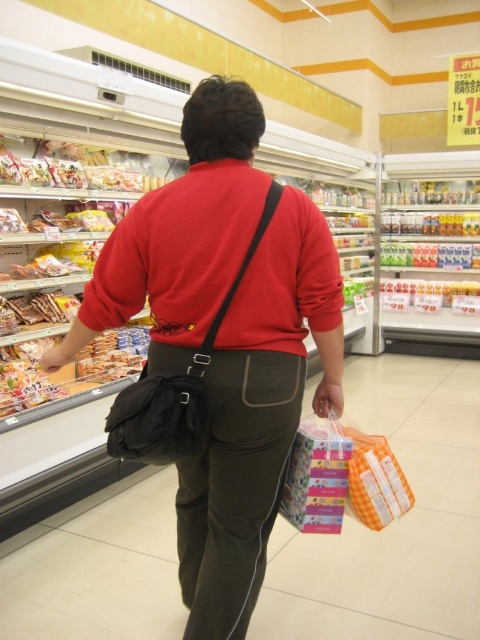
You are a store employee trying to determine which bag is taller between the matte black bag at center and the black fabric bag at back. Based on the scene, which one is taller?

The matte black bag at center is taller than the black fabric bag at back.

You are a security camera in the grocery store. You notice two black bags carried by a customer. The customer is facing away from you. Can you see the contents of both the matte black bag at center and the black fabric bag at back?

The black fabric bag at back is behind matte black bag at center, so you cannot see its contents. However, the matte black bag at center is visible, so its contents can be seen.

You are a store employee who needs to restock items. You see the matte black bag at center and the black fabric bag at back. Which bag is closer to the left side of the aisle?

The matte black bag at center is positioned on the left side of the black fabric bag at back, so it is closer to the left side of the aisle.